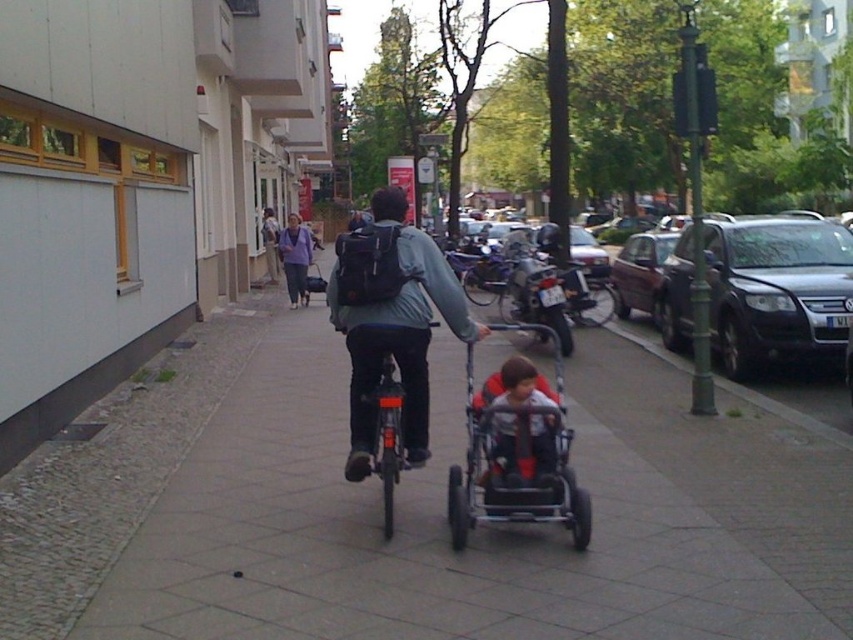
Question: Estimate the real-world distances between objects in this image. Which object is closer to the dark gray plastic stroller at center?

Choices:
 (A) gray concrete sidewalk at center
 (B) metallic maroon sedan at center-right
 (C) dark gray metallic suv at right

Answer: (A)

Question: Which of the following is the closest to the observer?

Choices:
 (A) (508, 435)
 (B) (347, 330)
 (C) (720, 637)
 (D) (668, 237)

Answer: (C)

Question: Can you confirm if gray concrete sidewalk at center is smaller than dark gray metallic suv at right?

Choices:
 (A) yes
 (B) no

Answer: (A)

Question: Which of the following is the closest to the observer?

Choices:
 (A) (476, 497)
 (B) (692, 323)
 (C) (743, 634)
 (D) (373, 246)

Answer: (C)

Question: Is gray concrete sidewalk at center further to camera compared to light brown fabric stroller at center?

Choices:
 (A) no
 (B) yes

Answer: (B)

Question: Can you confirm if dark gray metallic suv at right is smaller than matte black backpack at center?

Choices:
 (A) no
 (B) yes

Answer: (B)